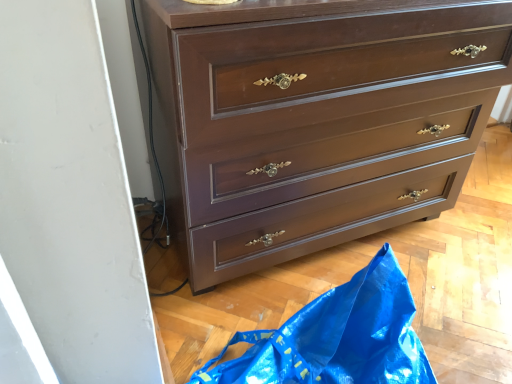
This screenshot has width=512, height=384. In order to click on free location to the right of matte brown dresser at center in this screenshot , I will do `click(468, 241)`.